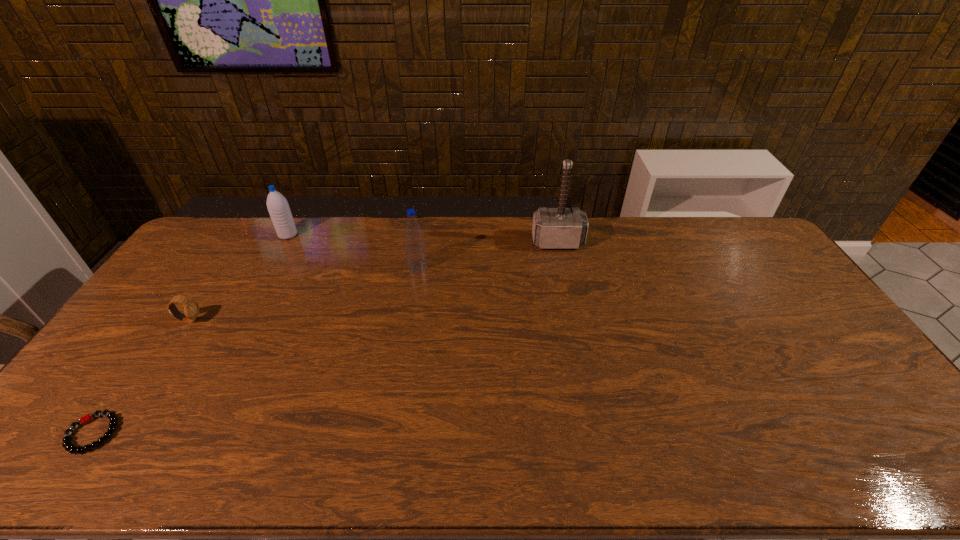
Where is `vacant area that lies between the shortest object and the nearer water bottle`? The image size is (960, 540). vacant area that lies between the shortest object and the nearer water bottle is located at coordinates (255, 350).

This screenshot has height=540, width=960. In order to click on blank region between the nearest object and the left water bottle in this screenshot , I will do `click(190, 334)`.

Locate an element on the screen. vacant area between the left water bottle and the watch is located at coordinates (239, 278).

Where is `free space that is in between the tallest object and the nearer water bottle`? free space that is in between the tallest object and the nearer water bottle is located at coordinates (488, 254).

Image resolution: width=960 pixels, height=540 pixels. I want to click on vacant region between the third nearest object and the bracelet, so click(x=255, y=350).

Where is `free spot between the third object from right to left and the second nearest object`? Image resolution: width=960 pixels, height=540 pixels. free spot between the third object from right to left and the second nearest object is located at coordinates (239, 278).

Identify which object is the closest to the third farthest object. Please provide its 2D coordinates. Your answer should be formatted as a tuple, i.e. [(x, y)], where the tuple contains the x and y coordinates of a point satisfying the conditions above.

[(553, 228)]

Identify the location of the third closest object relative to the third farthest object. (191, 308).

At what (x,y) coordinates should I click in order to perform the action: click on vacant space that satisfies the following two spatial constraints: 1. on the back side of the nearer water bottle; 2. on the right side of the shortest object. Please return your answer as a coordinate pair (x, y). Looking at the image, I should click on (x=208, y=267).

The height and width of the screenshot is (540, 960). Identify the location of vacant region that satisfies the following two spatial constraints: 1. on the back side of the bracelet; 2. on the right side of the third object from right to left. (231, 235).